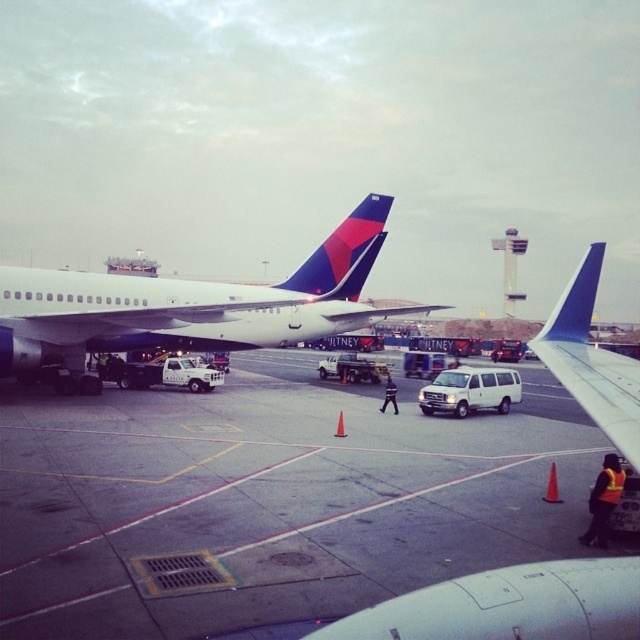
Question: Is white glossy airplane at center above white matte van at center?

Choices:
 (A) yes
 (B) no

Answer: (A)

Question: Which point appears closest to the camera in this image?

Choices:
 (A) (360, 269)
 (B) (108, 396)
 (C) (588, 276)

Answer: (C)

Question: Which is farther from the white matte van at center?

Choices:
 (A) smooth asphalt tarmac at center
 (B) matte blue airplane at center
 (C) blue painted wing at right

Answer: (B)

Question: Which object appears closest to the camera in this image?

Choices:
 (A) matte blue airplane at center
 (B) blue painted wing at right

Answer: (A)

Question: Is white glossy airplane at center above matte blue airplane at center?

Choices:
 (A) yes
 (B) no

Answer: (A)

Question: Can you confirm if smooth asphalt tarmac at center is bigger than white glossy airplane at center?

Choices:
 (A) yes
 (B) no

Answer: (B)